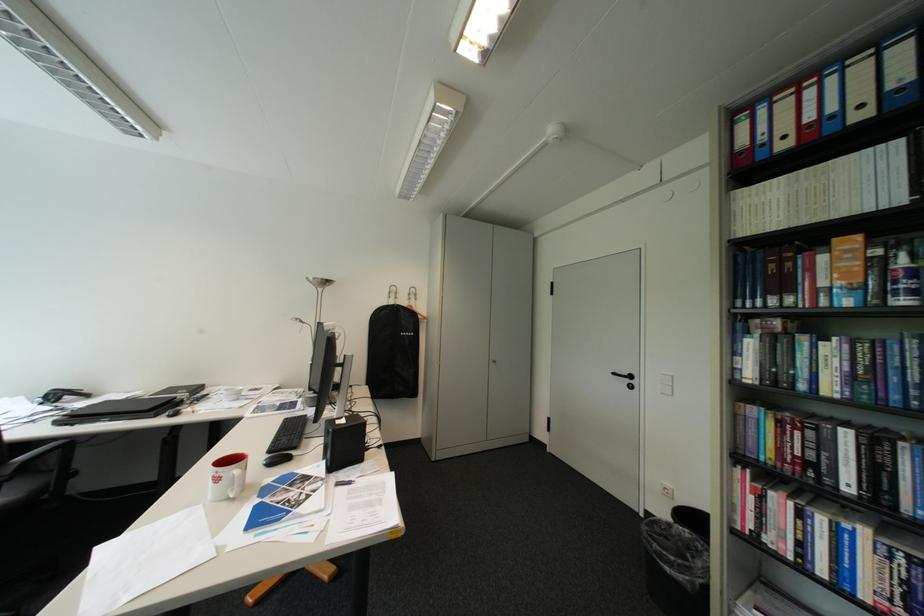
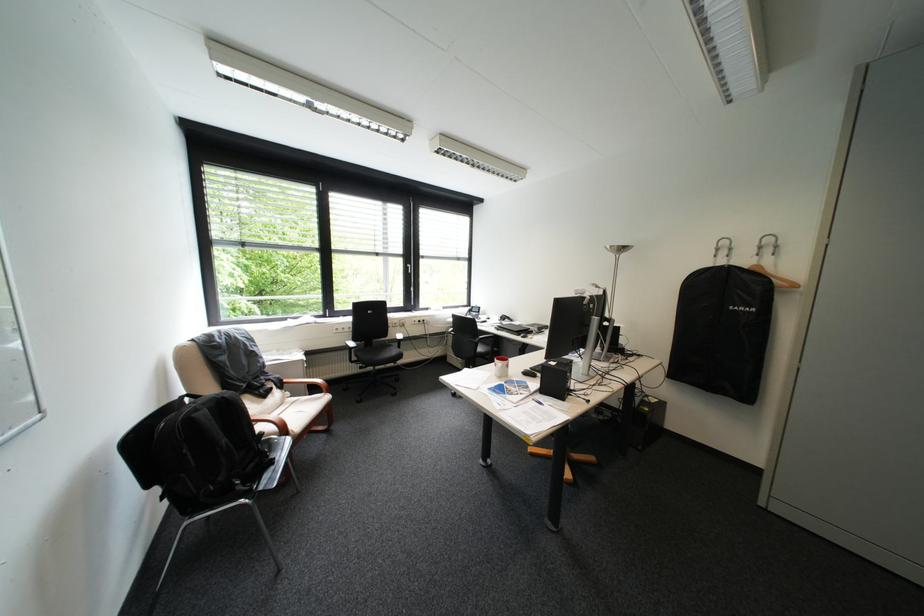
In the second image, find the point that corresponds to point (428, 294) in the first image.

(788, 246)